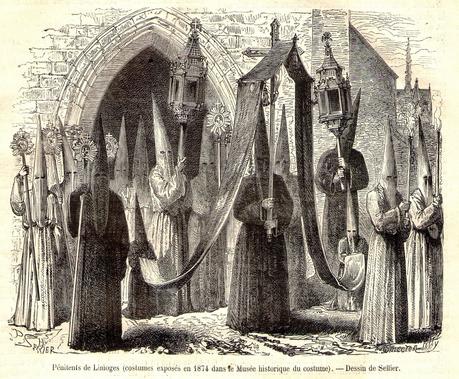
The width and height of the screenshot is (459, 379). I want to click on archway, so click(130, 89).